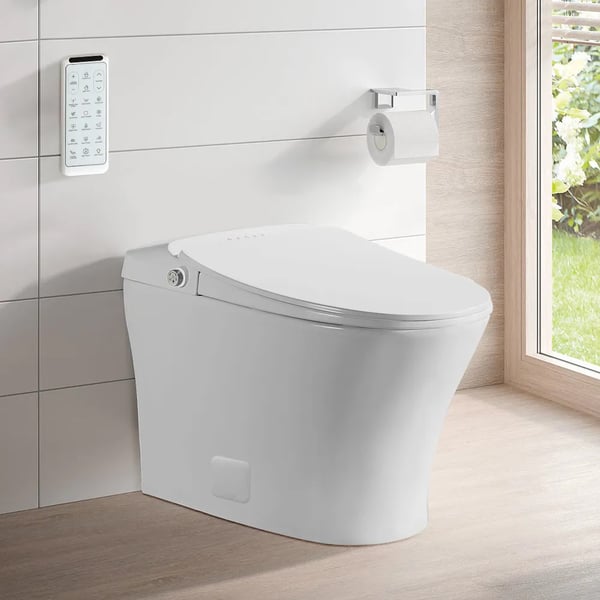
Locate an element on the screen. on the right of the toilet is located at coordinates (462, 436).